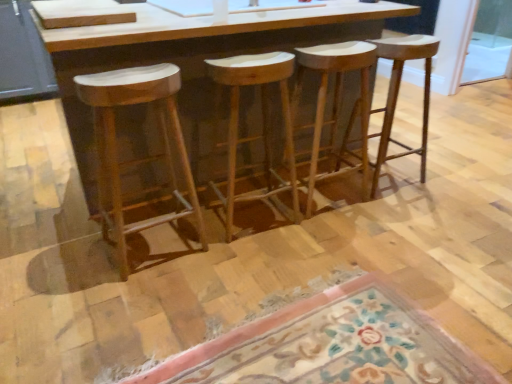
Question: From the image's perspective, is natural wood stool at left, which is counted as the fourth stool, starting from the right, below natural wood stool at center, the 1th stool from the right?

Choices:
 (A) yes
 (B) no

Answer: (A)

Question: Can you confirm if natural wood stool at left, arranged as the first stool when viewed from the left, is bigger than natural wood stool at center, the 1th stool from the right?

Choices:
 (A) no
 (B) yes

Answer: (A)

Question: Is natural wood stool at left, which is counted as the fourth stool, starting from the right, taller than natural wood stool at center, the 1th stool from the right?

Choices:
 (A) no
 (B) yes

Answer: (B)

Question: From the image's perspective, is natural wood stool at left, which is counted as the fourth stool, starting from the right, located above natural wood stool at center, the fourth stool viewed from the left?

Choices:
 (A) yes
 (B) no

Answer: (B)

Question: Considering the relative positions of natural wood stool at left, arranged as the first stool when viewed from the left, and natural wood stool at center, the 1th stool from the right, in the image provided, is natural wood stool at left, arranged as the first stool when viewed from the left, to the left of natural wood stool at center, the 1th stool from the right, from the viewer's perspective?

Choices:
 (A) yes
 (B) no

Answer: (A)

Question: From the image's perspective, is natural wood stool at center, which ranks as the third stool in left-to-right order, located above or below natural wood stool at center, the 3th stool when ordered from right to left?

Choices:
 (A) below
 (B) above

Answer: (B)

Question: In terms of width, does natural wood stool at center, which ranks as the third stool in left-to-right order, look wider or thinner when compared to natural wood stool at center, the 3th stool when ordered from right to left?

Choices:
 (A) wide
 (B) thin

Answer: (B)

Question: Based on their sizes in the image, would you say natural wood stool at center, the 2th stool in the right-to-left sequence, is bigger or smaller than natural wood stool at center, which appears as the second stool when viewed from the left?

Choices:
 (A) big
 (B) small

Answer: (B)

Question: Is natural wood stool at center, which ranks as the third stool in left-to-right order, spatially inside natural wood stool at center, which appears as the second stool when viewed from the left, or outside of it?

Choices:
 (A) inside
 (B) outside

Answer: (B)

Question: In the image, is transparent glass screen door at upper right positioned in front of or behind natural wood stool at left, which is counted as the fourth stool, starting from the right?

Choices:
 (A) front
 (B) behind

Answer: (B)

Question: From the image's perspective, is transparent glass screen door at upper right positioned above or below natural wood stool at left, arranged as the first stool when viewed from the left?

Choices:
 (A) below
 (B) above

Answer: (B)

Question: Is point (477, 56) positioned closer to the camera than point (106, 178)?

Choices:
 (A) farther
 (B) closer

Answer: (A)

Question: Considering the positions of transparent glass screen door at upper right and natural wood stool at left, arranged as the first stool when viewed from the left, in the image, is transparent glass screen door at upper right bigger or smaller than natural wood stool at left, arranged as the first stool when viewed from the left,?

Choices:
 (A) big
 (B) small

Answer: (B)

Question: From a real-world perspective, is natural wood stool at center, the 3th stool when ordered from right to left, positioned above or below floral carpet at lower center?

Choices:
 (A) above
 (B) below

Answer: (A)

Question: From the image's perspective, relative to floral carpet at lower center, is natural wood stool at center, the 3th stool when ordered from right to left, above or below?

Choices:
 (A) below
 (B) above

Answer: (B)